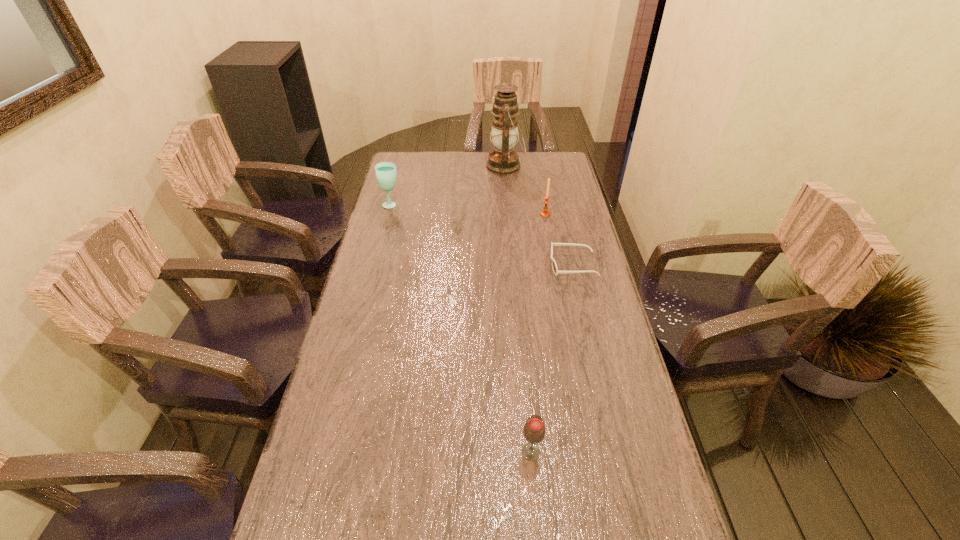
Locate an element on the screen. Image resolution: width=960 pixels, height=540 pixels. the farthest object is located at coordinates (502, 160).

Image resolution: width=960 pixels, height=540 pixels. I want to click on lantern, so click(x=502, y=160).

Find the location of a particular element. The height and width of the screenshot is (540, 960). the leftmost object is located at coordinates (386, 176).

You are a GUI agent. You are given a task and a screenshot of the screen. Output one action in this format:
    pyautogui.click(x=<x>, y=<y>)
    Task: Click on the left glass drink container
    This screenshot has width=960, height=540.
    Given the screenshot: What is the action you would take?
    pyautogui.click(x=386, y=176)

Find the location of `the third farthest object`. the third farthest object is located at coordinates (544, 213).

Where is `the shorter glass drink container`? The height and width of the screenshot is (540, 960). the shorter glass drink container is located at coordinates (534, 429).

Image resolution: width=960 pixels, height=540 pixels. I want to click on the right glass drink container, so click(x=534, y=429).

Where is `sunglasses`? This screenshot has height=540, width=960. sunglasses is located at coordinates (554, 266).

You are a GUI agent. You are given a task and a screenshot of the screen. Output one action in this format:
    pyautogui.click(x=<x>, y=<y>)
    Task: Click on the second nearest object
    This screenshot has height=540, width=960.
    Given the screenshot: What is the action you would take?
    pyautogui.click(x=554, y=266)

I want to click on blank space located 0.260m on the front of the tallest object, so click(510, 216).